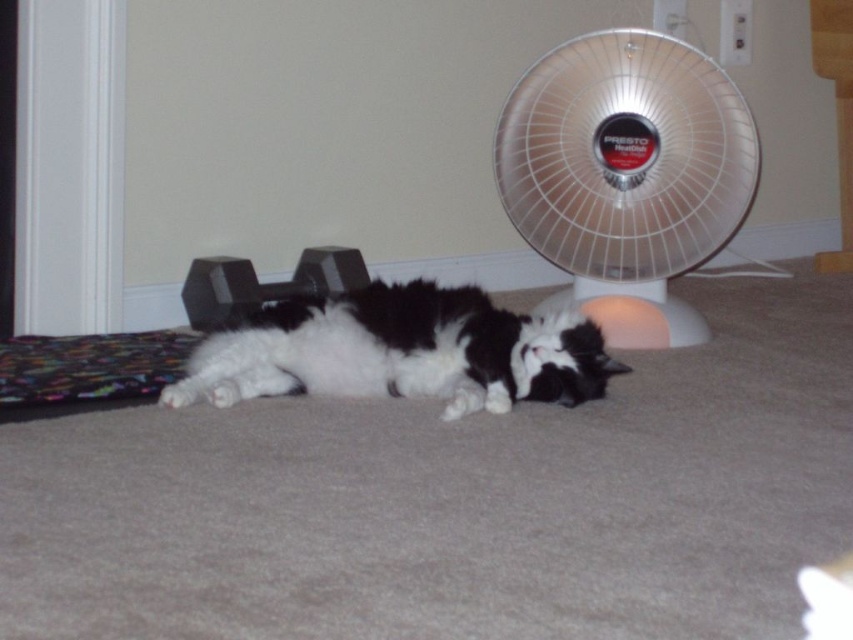
Which is more to the right, white plastic fan at center or fluffy white cat at center?

white plastic fan at center

Between white plastic fan at center and fluffy white cat at center, which one is positioned higher?

white plastic fan at center

Which is in front, point (637, 97) or point (378, 362)?

Point (378, 362)

Image resolution: width=853 pixels, height=640 pixels. I want to click on white plastic fan at center, so click(627, 173).

Between point (694, 339) and point (227, 292), which one is positioned behind?

Positioned behind is point (694, 339).

Which is more to the left, white plastic fan at center or black rubber dumbbell at center?

Positioned to the left is black rubber dumbbell at center.

Does point (691, 332) come behind point (321, 268)?

That is False.

The image size is (853, 640). I want to click on white plastic fan at center, so click(627, 173).

Can you confirm if fluffy white cat at center is positioned below black rubber dumbbell at center?

Yes.

Identify the location of fluffy white cat at center. The image size is (853, 640). (399, 352).

The width and height of the screenshot is (853, 640). I want to click on fluffy white cat at center, so click(x=399, y=352).